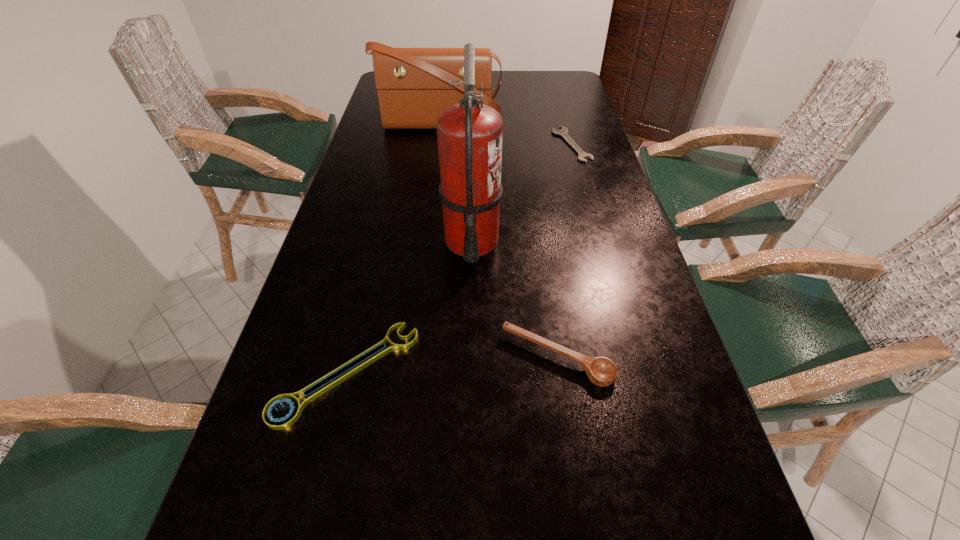
Image resolution: width=960 pixels, height=540 pixels. Find the location of `vacant space that satisfies the following two spatial constraints: 1. on the front flap of the right wrench; 2. on the right side of the satchel`. vacant space that satisfies the following two spatial constraints: 1. on the front flap of the right wrench; 2. on the right side of the satchel is located at coordinates (437, 145).

Identify the location of free region that satisfies the following two spatial constraints: 1. on the front flap of the wooden spoon; 2. on the right side of the satchel. (409, 357).